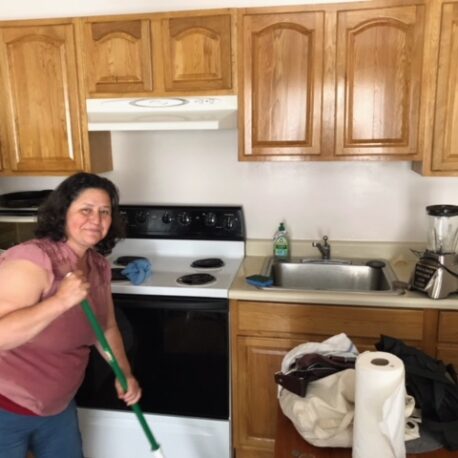
At what (x,y) coordinates should I click in order to perform the action: click on roll of paper towels. Please return your answer as a coordinate pair (x, y). The width and height of the screenshot is (458, 458). Looking at the image, I should click on (382, 383).